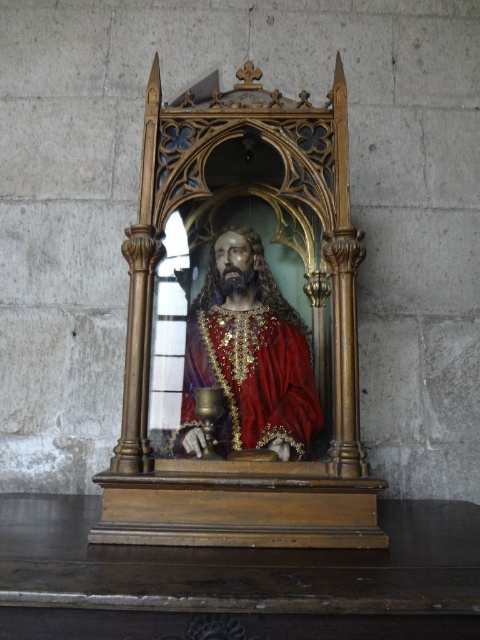
Consider the image. You are an art conservator examining the religious artifact. You need to determine which statue at center is easier to clean between the wooden statue at center and the shiny gold statue at center. Based on their sizes, which one might require more effort to clean?

The wooden statue at center is larger in size than the shiny gold statue at center, so it would require more effort to clean.

You are standing in front of the religious artifact and want to take a photo of the wooden statue at center. If your camera requires a minimum distance of 5 feet to focus properly, will you be able to take a clear photo from your current position?

The wooden statue at center and camera are 4.64 feet apart from each other. Since the required minimum distance is 5 feet, you are too close to take a clear photo. Move back to ensure proper focus.

You are an art conservator examining two statues in the center of a religious artifact display. The wooden statue at center and the shiny gold statue at center are both part of the exhibit. Which statue has a greater width according to the description?

The wooden statue at center has a greater width than the shiny gold statue at center.